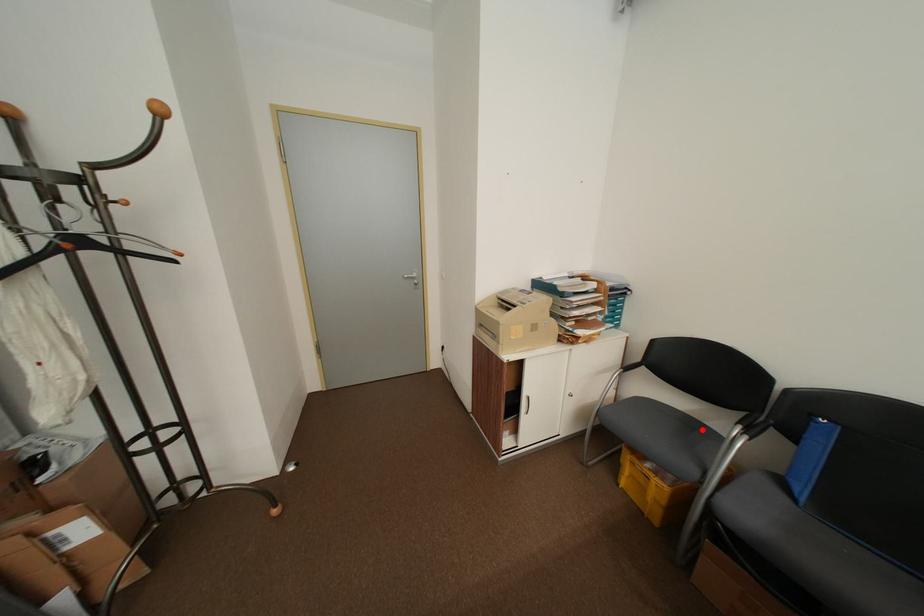
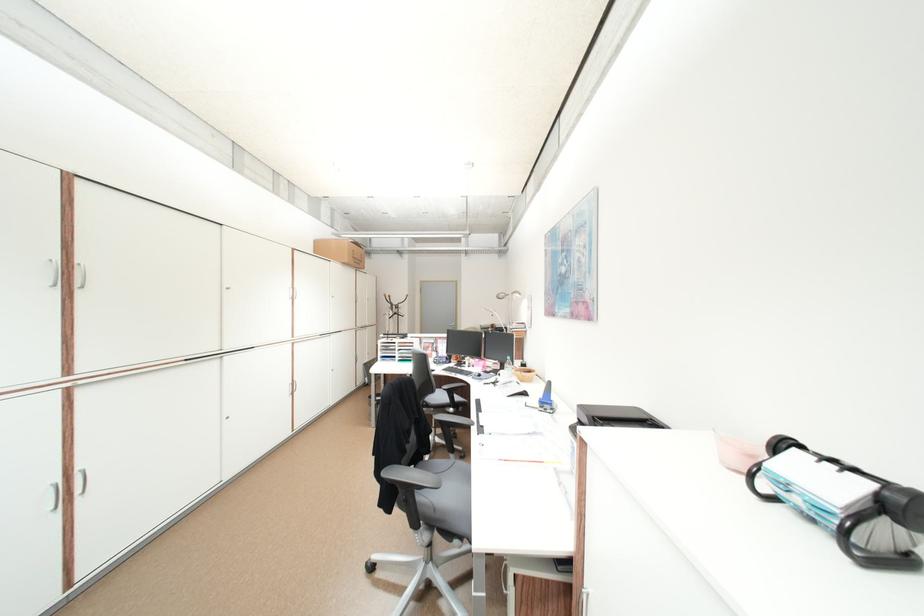
Question: I am providing you with two images of the same scene from different viewpoints. A red point is marked on the first image. At the location where the point appears in image 1, is it still visible in image 2?

Choices:
 (A) Yes
 (B) No

Answer: (B)